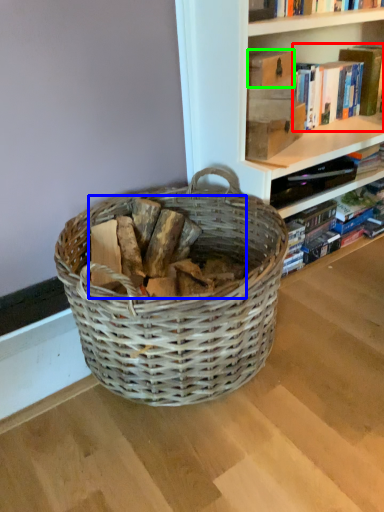
Question: Which is nearer to the book (highlighted by a red box)? debris (highlighted by a blue box) or paperback book (highlighted by a green box).

Choices:
 (A) debris
 (B) paperback book

Answer: (B)